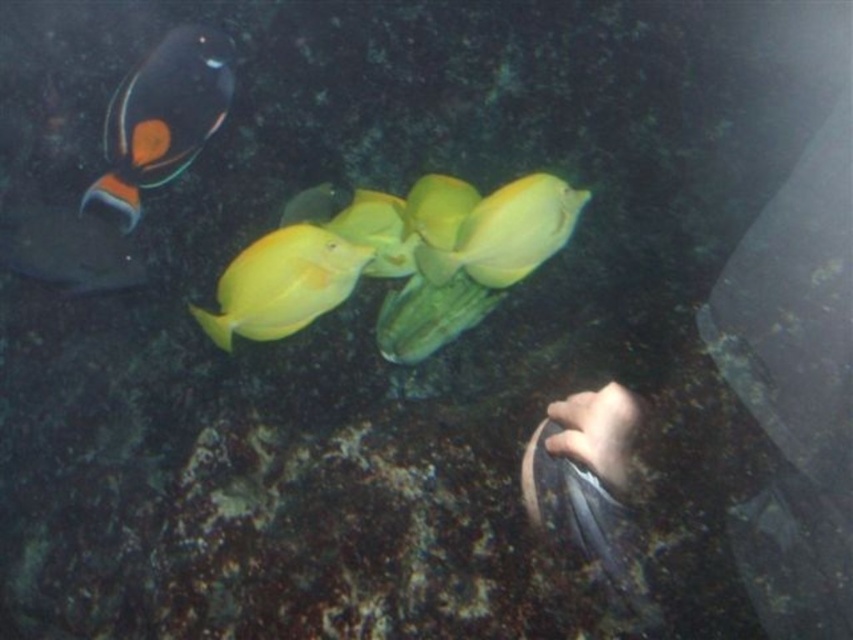
Can you confirm if yellow matte fish at center is positioned to the left of shiny black fish at left?

Incorrect, yellow matte fish at center is not on the left side of shiny black fish at left.

Does yellow matte fish at center have a greater height compared to shiny black fish at left?

No, yellow matte fish at center is not taller than shiny black fish at left.

Is point (459, 244) closer to viewer compared to point (102, 266)?

Yes, point (459, 244) is closer to viewer.

Where is `yellow matte fish at center`? Image resolution: width=853 pixels, height=640 pixels. yellow matte fish at center is located at coordinates (508, 232).

Is shiny yellow fish at center positioned before shiny black fish at left?

Yes, shiny yellow fish at center is closer to the viewer.

Who is lower down, shiny yellow fish at center or shiny black fish at left?

Positioned lower is shiny yellow fish at center.

Does point (285, 264) come farther from viewer compared to point (44, 257)?

That is False.

I want to click on shiny yellow fish at center, so click(x=282, y=284).

Can you confirm if orange and black textured fish at upper left is taller than shiny yellow fish at center?

Correct, orange and black textured fish at upper left is much taller as shiny yellow fish at center.

Consider the image. Can you confirm if orange and black textured fish at upper left is bigger than shiny yellow fish at center?

Yes.

You are a GUI agent. You are given a task and a screenshot of the screen. Output one action in this format:
    pyautogui.click(x=<x>, y=<y>)
    Task: Click on the orange and black textured fish at upper left
    Image resolution: width=853 pixels, height=640 pixels.
    Given the screenshot: What is the action you would take?
    pyautogui.click(x=163, y=115)